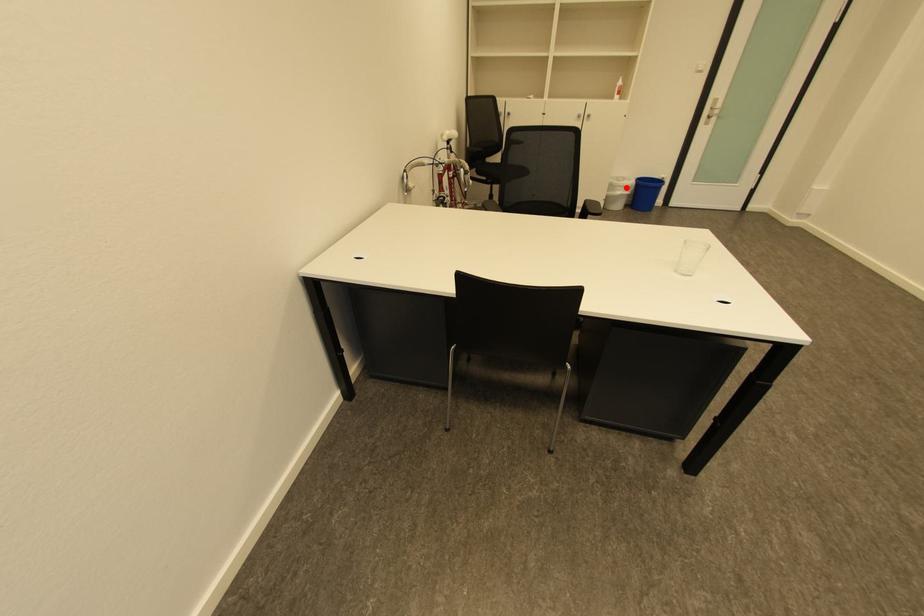
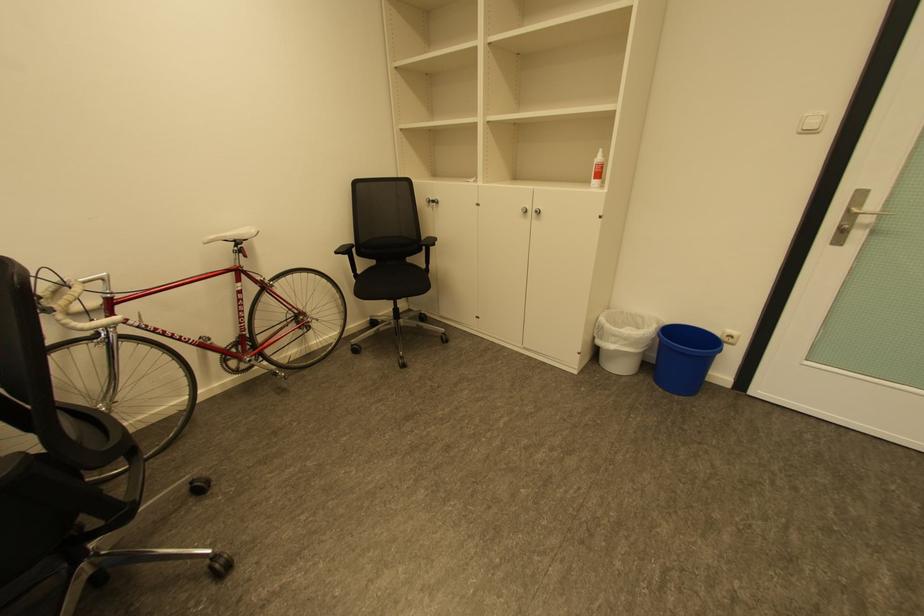
Question: A red point is marked in image1. In image2, is the corresponding 3D point closer to the camera or farther? Reply with the corresponding letter.

Choices:
 (A) The corresponding 3D point is closer.
 (B) The corresponding 3D point is farther.

Answer: (B)